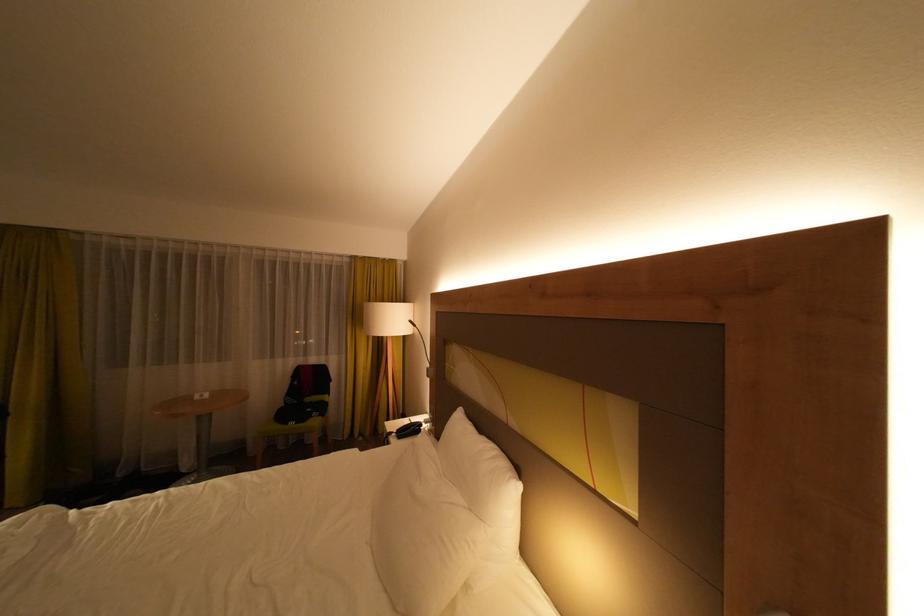
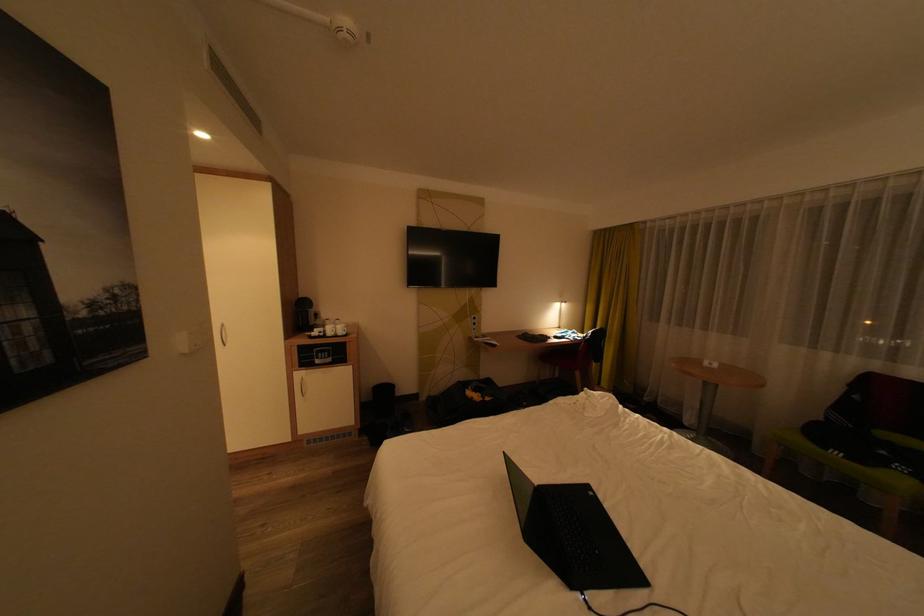
Question: I am providing you with two images of the same scene from different viewpoints. Which of the following objects are not visible in image2?

Choices:
 (A) small white cup
 (B) green chair sitting surface
 (C) white light switch
 (D) none of these

Answer: (D)